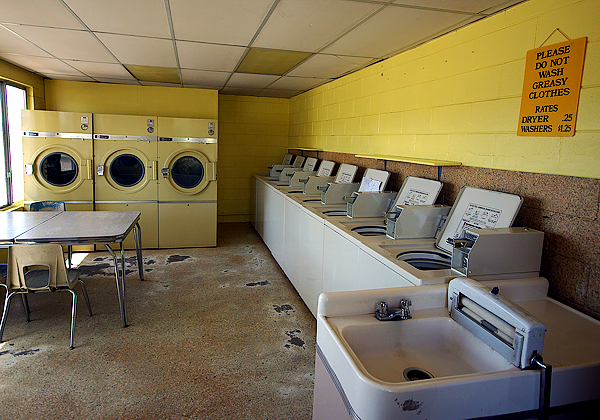
Locate an element on the screen. sink is located at coordinates (380, 353).